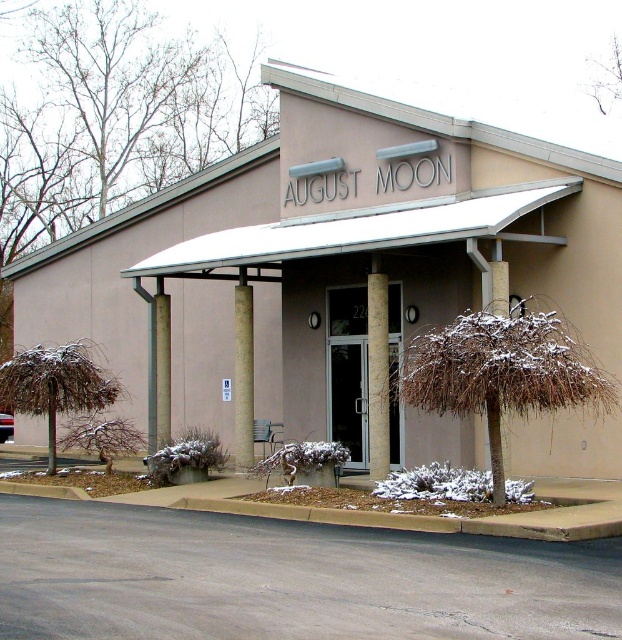
From the picture: You are standing in front of the August Moon building and want to take a photo of the entrance. The gray concrete column at center is blocking your view. Can you move to the left or right to avoid it while keeping the beige concrete building at center in the frame?

The beige concrete building at center is in front of the gray concrete column at center, so moving to the left or right might allow you to position yourself where the column is no longer blocking the view while still keeping the building in the frame.

You are standing at the entrance of August Moon building and want to locate the beige concrete pillar at center. According to the coordinates provided, where should you look to find it?

The beige concrete pillar at center is located at coordinates point (378, 376).

You are standing at the entrance of August Moon and want to walk towards the point labeled as point (238,305). However, there is an obstacle at point labeled as point (509,189). Will you encounter the obstacle before reaching your destination?

Yes, you will encounter the obstacle at point (509,189) before reaching your destination at point (238,305) because point (509,189) is in front of point (238,305).